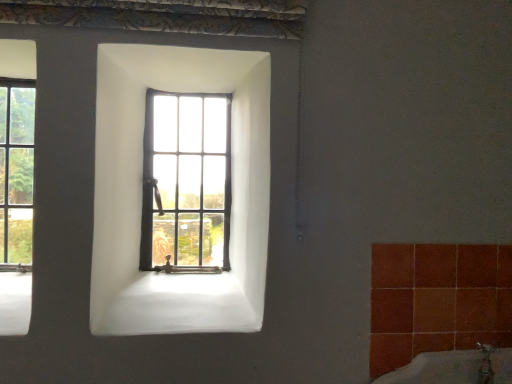
Question: Is wooden-framed window at center, positioned as the 1th window in right-to-left order, in front of or behind clear glass window at left, which appears as the 2th window when viewed from the right, in the image?

Choices:
 (A) behind
 (B) front

Answer: (A)

Question: From the image's perspective, relative to clear glass window at left, which appears as the 2th window when viewed from the right, is wooden-framed window at center, which is the 2th window from left to right, above or below?

Choices:
 (A) below
 (B) above

Answer: (A)

Question: In terms of height, does wooden-framed window at center, which is the 2th window from left to right, look taller or shorter compared to clear glass window at left, which appears as the 2th window when viewed from the right?

Choices:
 (A) tall
 (B) short

Answer: (B)

Question: Considering the positions of point (19, 304) and point (207, 112), is point (19, 304) closer or farther from the camera than point (207, 112)?

Choices:
 (A) farther
 (B) closer

Answer: (B)

Question: From a real-world perspective, is clear glass window at left, the 1th window positioned from the left, physically located above or below wooden-framed window at center, positioned as the 1th window in right-to-left order?

Choices:
 (A) above
 (B) below

Answer: (A)

Question: Which is correct: clear glass window at left, the 1th window positioned from the left, is inside wooden-framed window at center, which is the 2th window from left to right, or outside of it?

Choices:
 (A) outside
 (B) inside

Answer: (A)

Question: Based on their positions, is clear glass window at left, which appears as the 2th window when viewed from the right, located to the left or right of wooden-framed window at center, which is the 2th window from left to right?

Choices:
 (A) right
 (B) left

Answer: (B)